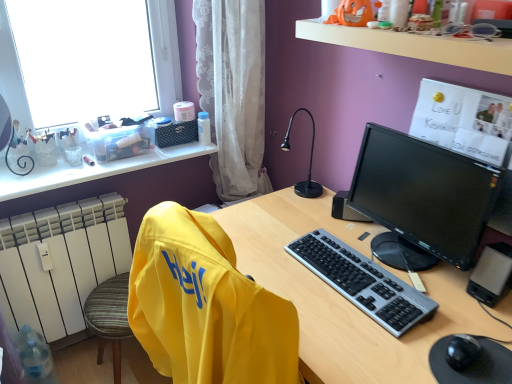
I want to click on vacant space behind black rubber mouse at lower right, so click(x=443, y=305).